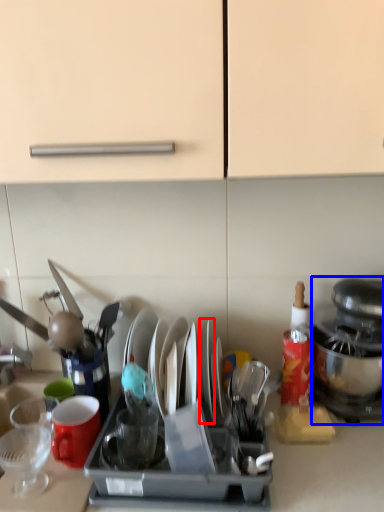
Question: Which of the following is the farthest to the observer, tableware (highlighted by a red box) or kitchen appliance (highlighted by a blue box)?

Choices:
 (A) tableware
 (B) kitchen appliance

Answer: (A)